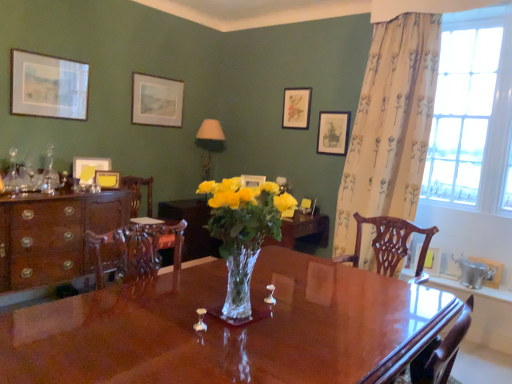
The width and height of the screenshot is (512, 384). I want to click on free space behind clear glass vase at center, so click(x=274, y=288).